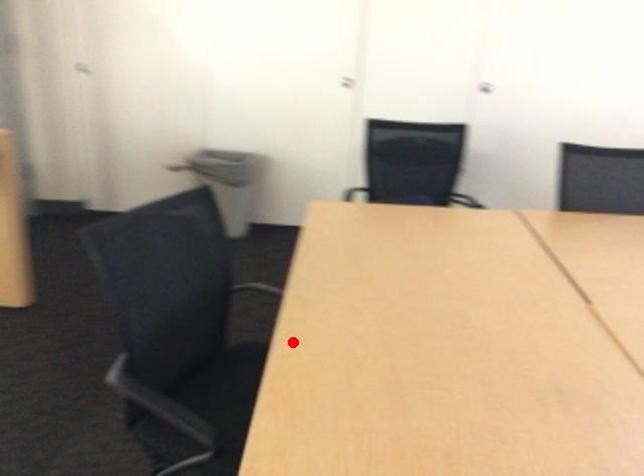
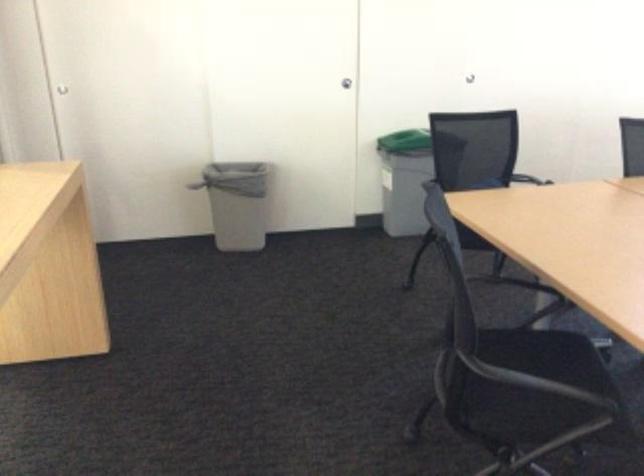
The point at the highlighted location is marked in the first image. Where is the corresponding point in the second image?

(542, 347)